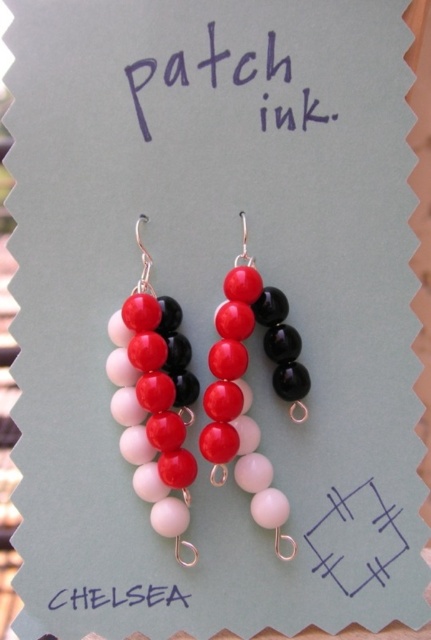
Is point (350, 531) more distant than point (146, 596)?

Yes, it is.

Does blue line at center appear over blue ink writing at center?

Yes.

Find the location of `blue line at center`. blue line at center is located at coordinates (356, 538).

Can you confirm if matte glass beads at center is thinner than shiny glass beads at center?

Correct, matte glass beads at center's width is less than shiny glass beads at center's.

Which is behind, point (136, 317) or point (236, 403)?

Point (236, 403)

Does point (141, 477) come closer to viewer compared to point (214, 320)?

Yes, it is.

Where is `matte glass beads at center`? matte glass beads at center is located at coordinates (153, 403).

Between matte glass beads at center and blue line at center, which one appears on the left side from the viewer's perspective?

Positioned to the left is matte glass beads at center.

Does matte glass beads at center have a greater width compared to blue line at center?

No, matte glass beads at center is not wider than blue line at center.

At what (x,y) coordinates should I click in order to perform the action: click on matte glass beads at center. Please return your answer as a coordinate pair (x, y). The width and height of the screenshot is (431, 640). Looking at the image, I should click on (153, 403).